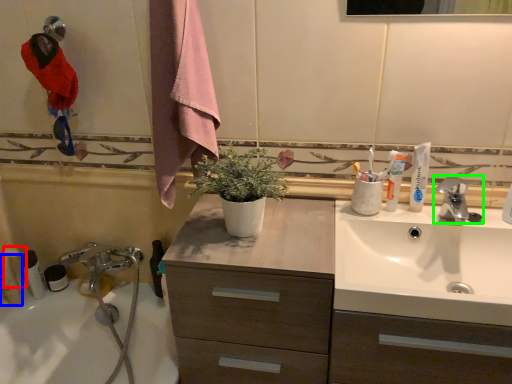
Question: Which is nearer to the toiletry (highlighted by a red box)? toiletry (highlighted by a blue box) or tap (highlighted by a green box).

Choices:
 (A) toiletry
 (B) tap

Answer: (A)